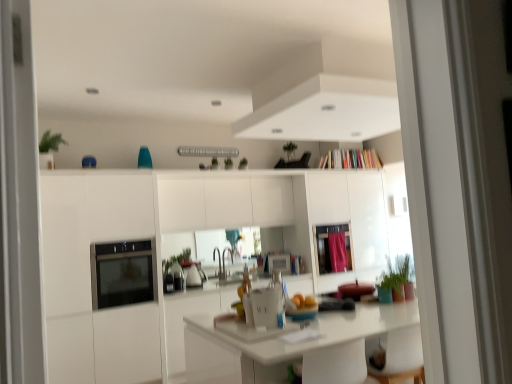
Question: From a real-world perspective, is pink fabric curtain at upper center physically located above or below green matte plant at lower right, arranged as the 3th plant when viewed from the back?

Choices:
 (A) below
 (B) above

Answer: (B)

Question: Considering the positions of point (332, 241) and point (411, 294), is point (332, 241) closer or farther from the camera than point (411, 294)?

Choices:
 (A) closer
 (B) farther

Answer: (B)

Question: Which object is positioned farthest from the black glass oven at lower left?

Choices:
 (A) green matte plant at upper center, the 1th plant positioned from the back
 (B) white glossy microwave at center
 (C) green matte plant at lower right, placed as the 1th plant when sorted from right to left
 (D) pink fabric screen door at center
 (E) green matte plant at upper center, which is counted as the 2th plant, starting from the bottom

Answer: (D)

Question: Which object is the farthest from the pink fabric curtain at upper center?

Choices:
 (A) pink fabric screen door at center
 (B) green matte plant at lower right, arranged as the 3th plant when viewed from the back
 (C) white glossy microwave at center
 (D) black glass oven at lower left
 (E) green matte plant at upper center, which ranks as the 3th plant in right-to-left order

Answer: (D)